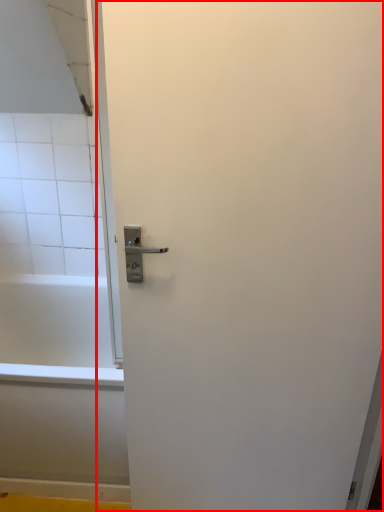
Question: Considering the relative positions of screen door (annotated by the red box) and bathtub in the image provided, where is screen door (annotated by the red box) located with respect to the staircase?

Choices:
 (A) right
 (B) left

Answer: (A)